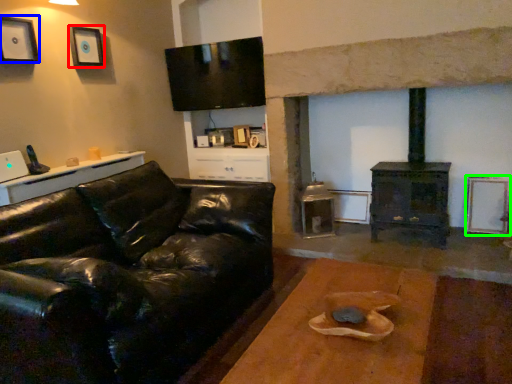
Question: Considering the real-world distances, which object is closest to picture frame (highlighted by a red box)? picture frame (highlighted by a blue box) or picture frame (highlighted by a green box).

Choices:
 (A) picture frame
 (B) picture frame

Answer: (A)